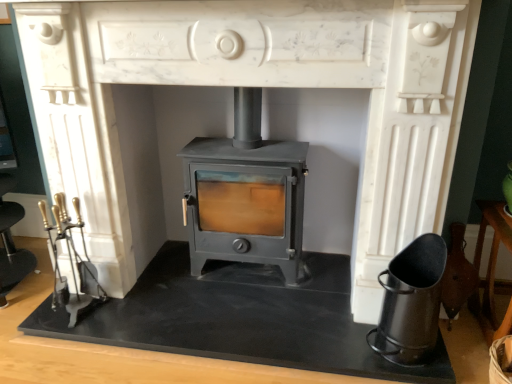
Find the location of `black matte ash bucket at lower right`. black matte ash bucket at lower right is located at coordinates (411, 302).

Where is `matte gray wood burning stove at center`? The width and height of the screenshot is (512, 384). matte gray wood burning stove at center is located at coordinates (245, 194).

What is the approximate height of black slate at center?

It is 7.13 centimeters.

This screenshot has height=384, width=512. I want to click on black matte ash bucket at lower right, so [x=411, y=302].

Does matte gray wood burning stove at center lie in front of black matte ash bucket at lower right?

That is False.

Considering the relative sizes of matte gray wood burning stove at center and black matte ash bucket at lower right in the image provided, is matte gray wood burning stove at center smaller than black matte ash bucket at lower right?

Incorrect, matte gray wood burning stove at center is not smaller in size than black matte ash bucket at lower right.

From a real-world perspective, between matte gray wood burning stove at center and black matte ash bucket at lower right, who is vertically lower?

black matte ash bucket at lower right, from a real-world perspective.

Considering the relative positions of matte gray wood burning stove at center and black matte ash bucket at lower right in the image provided, is matte gray wood burning stove at center to the right of black matte ash bucket at lower right from the viewer's perspective?

No, matte gray wood burning stove at center is not to the right of black matte ash bucket at lower right.

Is black slate at center aimed at black matte ash bucket at lower right?

No, black slate at center is not oriented towards black matte ash bucket at lower right.

Is there a large distance between black slate at center and black matte ash bucket at lower right?

No, black slate at center is in close proximity to black matte ash bucket at lower right.

From the image's perspective, is black slate at center below black matte ash bucket at lower right?

Yes, from the image's perspective, black slate at center is below black matte ash bucket at lower right.

Is black slate at center positioned before black matte ash bucket at lower right?

No, black slate at center is behind black matte ash bucket at lower right.

Would you say black matte ash bucket at lower right is a long distance from matte gray wood burning stove at center?

No.

From the image's perspective, would you say black matte ash bucket at lower right is positioned over matte gray wood burning stove at center?

No, from the image's perspective, black matte ash bucket at lower right is not on top of matte gray wood burning stove at center.

Considering the sizes of objects black matte ash bucket at lower right and matte gray wood burning stove at center in the image provided, who is shorter, black matte ash bucket at lower right or matte gray wood burning stove at center?

Standing shorter between the two is black matte ash bucket at lower right.

Between black slate at center and matte gray wood burning stove at center, which one has smaller size?

Smaller between the two is black slate at center.

Could you tell me if black slate at center is facing matte gray wood burning stove at center?

No, black slate at center is not turned towards matte gray wood burning stove at center.

From a real-world perspective, which is physically below, matte gray wood burning stove at center or black slate at center?

From a 3D spatial view, black slate at center is below.

Visually, is matte gray wood burning stove at center positioned to the left or to the right of black slate at center?

matte gray wood burning stove at center is to the right of black slate at center.

Which is less distant, (238, 121) or (104, 318)?

Point (238, 121).

Which object is positioned more to the left, black matte ash bucket at lower right or black slate at center?

black slate at center.

Find the location of a particular element. This screenshot has width=512, height=384. slate on the left side of black matte ash bucket at lower right is located at coordinates (240, 318).

Are black matte ash bucket at lower right and black slate at center beside each other?

There is a gap between black matte ash bucket at lower right and black slate at center.

Which object is further away from the camera, black matte ash bucket at lower right or black slate at center?

black slate at center.

Locate an element on the screen. This screenshot has height=384, width=512. appliance that appears on the right of matte gray wood burning stove at center is located at coordinates (411, 302).

This screenshot has height=384, width=512. In order to click on appliance above the black slate at center (from a real-world perspective) in this screenshot , I will do `click(411, 302)`.

When comparing their distances from black matte ash bucket at lower right, does matte gray wood burning stove at center or black slate at center seem closer?

black slate at center lies closer to black matte ash bucket at lower right than the other object.

Looking at the image, which one is located closer to matte gray wood burning stove at center, black slate at center or black matte ash bucket at lower right?

The object closer to matte gray wood burning stove at center is black slate at center.

Considering their positions, is black slate at center positioned closer to black matte ash bucket at lower right than matte gray wood burning stove at center?

black slate at center.

Considering their positions, is black matte ash bucket at lower right positioned closer to black slate at center than matte gray wood burning stove at center?

matte gray wood burning stove at center lies closer to black slate at center than the other object.

Estimate the real-world distances between objects in this image. Which object is further from black slate at center, matte gray wood burning stove at center or black matte ash bucket at lower right?

black matte ash bucket at lower right is further to black slate at center.

Based on their spatial positions, is black matte ash bucket at lower right or black slate at center further from matte gray wood burning stove at center?

black matte ash bucket at lower right is further to matte gray wood burning stove at center.

This screenshot has width=512, height=384. Find the location of `wood burning stove located between black slate at center and black matte ash bucket at lower right in the left-right direction`. wood burning stove located between black slate at center and black matte ash bucket at lower right in the left-right direction is located at coordinates (245, 194).